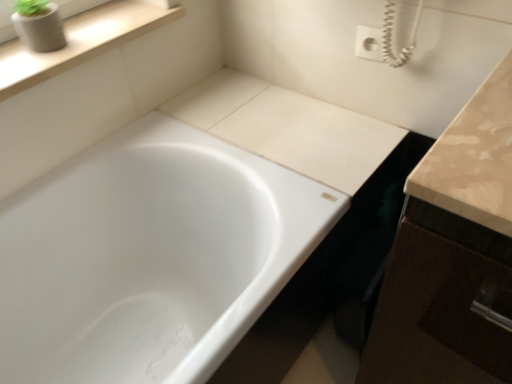
Identify the location of vacant area that is in front of matte gray concrete planter at upper left. The width and height of the screenshot is (512, 384). (30, 64).